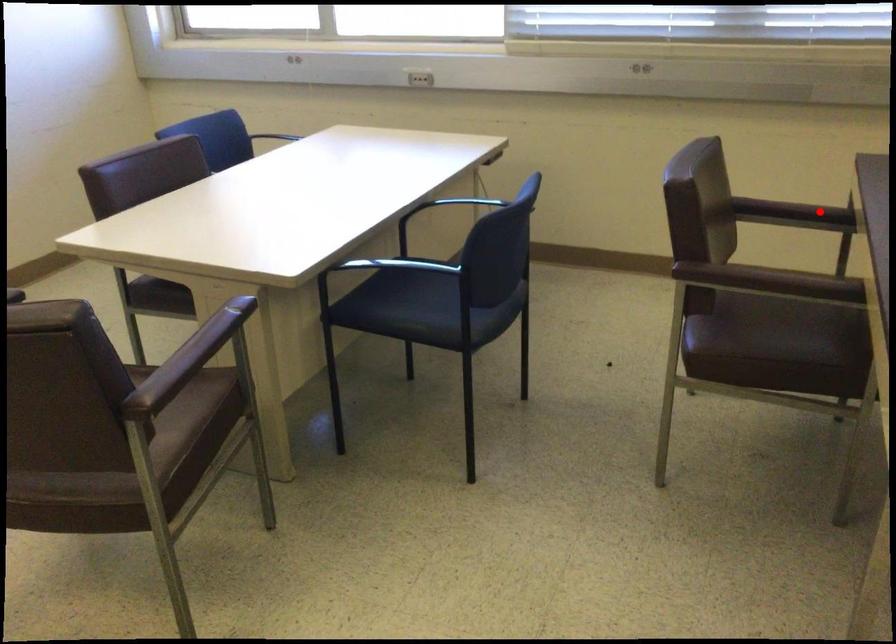
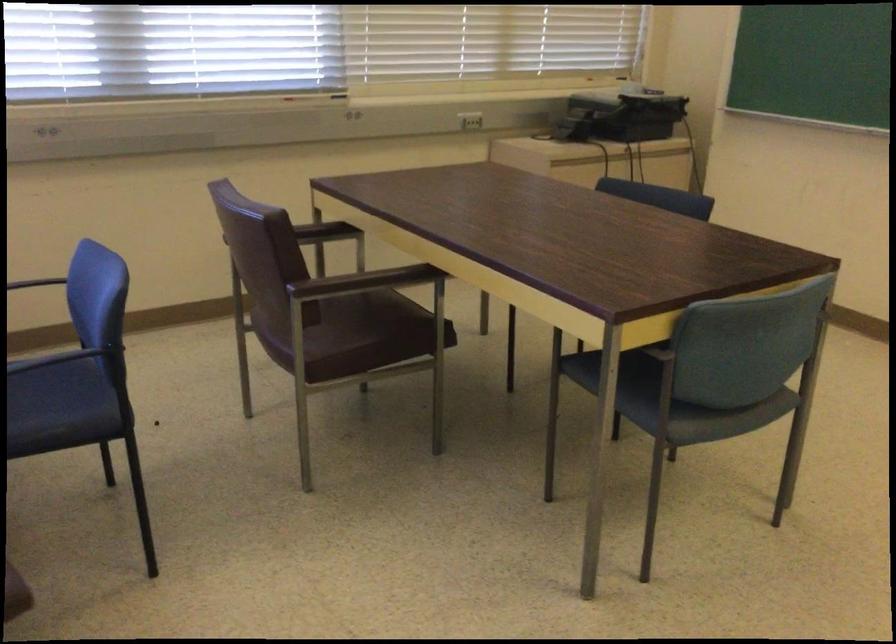
Question: I am providing you with two images of the same scene from different viewpoints. Given a red point in image1, look at the same physical point in image2. Is it:

Choices:
 (A) Closer to the viewpoint
 (B) Farther from the viewpoint

Answer: (B)